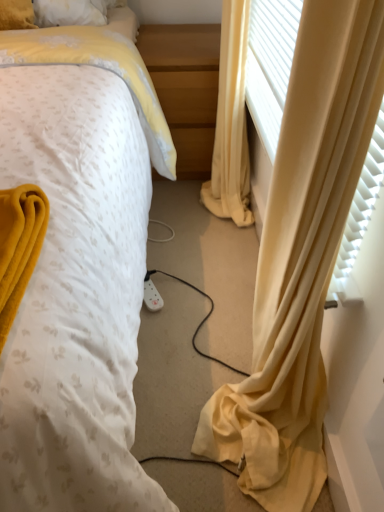
Question: Does light wood/finely finished nightstand at center have a greater width compared to yellow fabric curtain at right?

Choices:
 (A) yes
 (B) no

Answer: (A)

Question: Is light wood/finely finished nightstand at center to the right of yellow fabric curtain at right from the viewer's perspective?

Choices:
 (A) no
 (B) yes

Answer: (A)

Question: Does light wood/finely finished nightstand at center have a smaller size compared to yellow fabric curtain at right?

Choices:
 (A) no
 (B) yes

Answer: (A)

Question: From the image's perspective, is light wood/finely finished nightstand at center beneath yellow fabric curtain at right?

Choices:
 (A) no
 (B) yes

Answer: (A)

Question: From a real-world perspective, is light wood/finely finished nightstand at center over yellow fabric curtain at right?

Choices:
 (A) yes
 (B) no

Answer: (B)

Question: From a real-world perspective, is yellow fabric curtain at right physically located above or below white dotted fabric at center?

Choices:
 (A) below
 (B) above

Answer: (A)

Question: Do you think yellow fabric curtain at right is within white dotted fabric at center, or outside of it?

Choices:
 (A) inside
 (B) outside

Answer: (B)

Question: From the image's perspective, is yellow fabric curtain at right located above or below white dotted fabric at center?

Choices:
 (A) above
 (B) below

Answer: (A)

Question: Considering the positions of point (231, 94) and point (148, 494), is point (231, 94) closer or farther from the camera than point (148, 494)?

Choices:
 (A) closer
 (B) farther

Answer: (B)

Question: Considering the positions of light wood/finely finished nightstand at center and white dotted fabric at center in the image, is light wood/finely finished nightstand at center bigger or smaller than white dotted fabric at center?

Choices:
 (A) small
 (B) big

Answer: (A)

Question: From the image's perspective, is light wood/finely finished nightstand at center located above or below white dotted fabric at center?

Choices:
 (A) above
 (B) below

Answer: (A)

Question: Visually, is light wood/finely finished nightstand at center positioned to the left or to the right of white dotted fabric at center?

Choices:
 (A) right
 (B) left

Answer: (A)

Question: Is light wood/finely finished nightstand at center taller or shorter than white dotted fabric at center?

Choices:
 (A) short
 (B) tall

Answer: (A)

Question: In terms of size, does yellow fabric curtain at right appear bigger or smaller than light wood/finely finished nightstand at center?

Choices:
 (A) small
 (B) big

Answer: (A)

Question: Looking at their shapes, would you say yellow fabric curtain at right is wider or thinner than light wood/finely finished nightstand at center?

Choices:
 (A) thin
 (B) wide

Answer: (A)